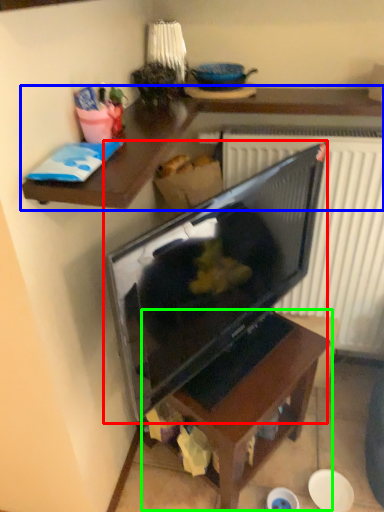
Question: Which object is positioned closest to television (highlighted by a red box)? Select from desk (highlighted by a blue box) and table (highlighted by a green box).

Choices:
 (A) desk
 (B) table

Answer: (B)